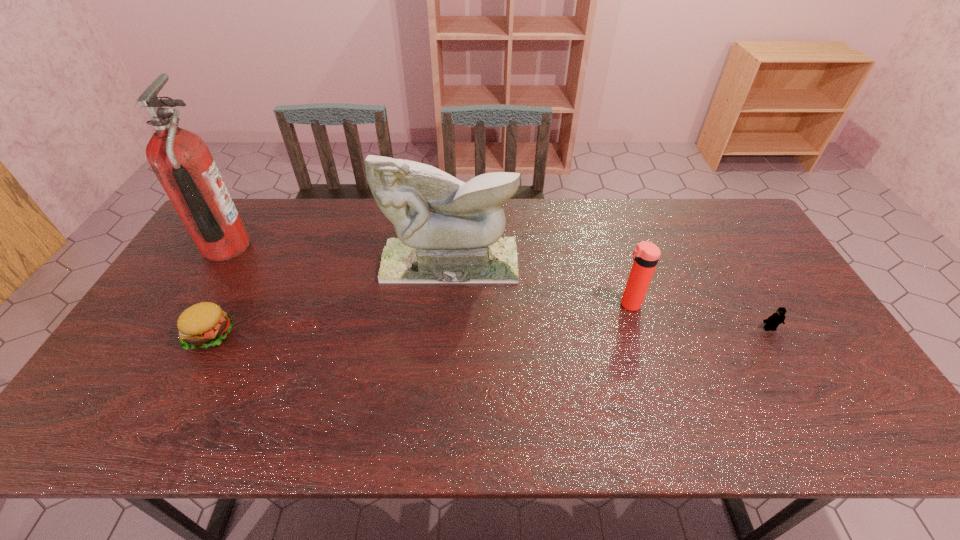
Locate an element on the screen. The image size is (960, 540). free space located on the right of the hamburger is located at coordinates (256, 335).

Locate an element on the screen. The width and height of the screenshot is (960, 540). free space located 0.050m on the face of the Lego is located at coordinates (780, 347).

Where is `fire extinguisher present at the far edge`? The image size is (960, 540). fire extinguisher present at the far edge is located at coordinates (182, 162).

The width and height of the screenshot is (960, 540). Identify the location of sculpture present at the far edge. (449, 231).

In order to click on fire extinguisher situated at the left edge in this screenshot , I will do `click(182, 162)`.

Locate an element on the screen. hamburger that is positioned at the left edge is located at coordinates (205, 324).

Image resolution: width=960 pixels, height=540 pixels. I want to click on object present at the right edge, so click(771, 323).

Find the location of `object that is positioned at the far left corner`. object that is positioned at the far left corner is located at coordinates (182, 162).

This screenshot has height=540, width=960. In the image, there is a desktop. Find the location of `vacant space at the far edge`. vacant space at the far edge is located at coordinates (339, 226).

At what (x,y) coordinates should I click in order to perform the action: click on free space at the near edge of the desktop. Please return your answer as a coordinate pair (x, y). The image size is (960, 540). Looking at the image, I should click on (742, 416).